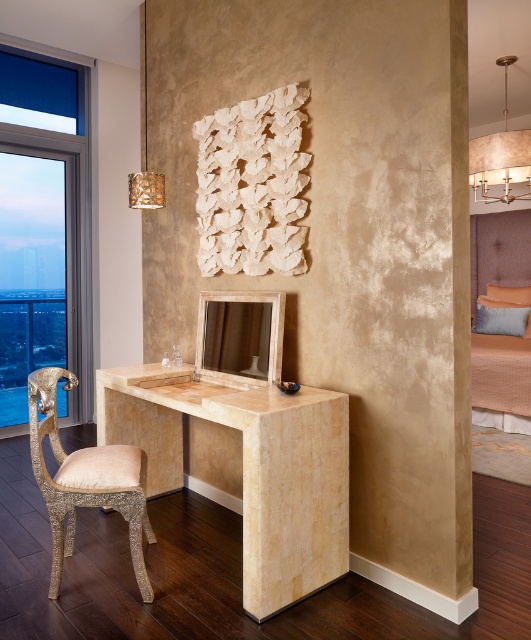
Which is below, gold glittery armchair at left or beige fabric bed at right?

gold glittery armchair at left is lower down.

Between point (132, 481) and point (500, 412), which one is positioned in front?

Point (132, 481) is in front.

Does point (58, 531) come behind point (476, 397)?

No, it is not.

This screenshot has width=531, height=640. Identify the location of gold glittery armchair at left. (85, 480).

Between clear glass window at left and gold glittery armchair at left, which one is positioned higher?

clear glass window at left is higher up.

Who is positioned more to the right, clear glass window at left or gold glittery armchair at left?

From the viewer's perspective, gold glittery armchair at left appears more on the right side.

Image resolution: width=531 pixels, height=640 pixels. What are the coordinates of `clear glass window at left` in the screenshot? It's located at (44, 230).

This screenshot has height=640, width=531. What are the coordinates of `clear glass window at left` in the screenshot? It's located at (44, 230).

Who is taller, beige marble desk at center or clear glass window at left?

Standing taller between the two is clear glass window at left.

Which is above, beige marble desk at center or clear glass window at left?

clear glass window at left is higher up.

Identify the location of beige marble desk at center. (249, 468).

The image size is (531, 640). I want to click on beige marble desk at center, so click(x=249, y=468).